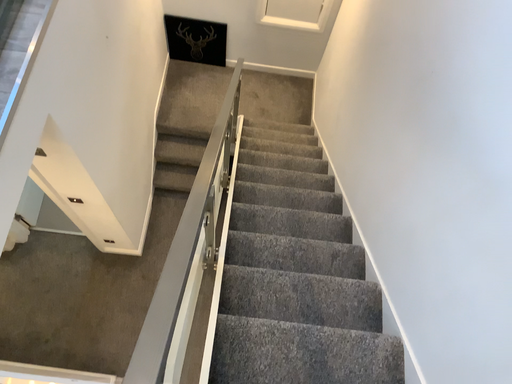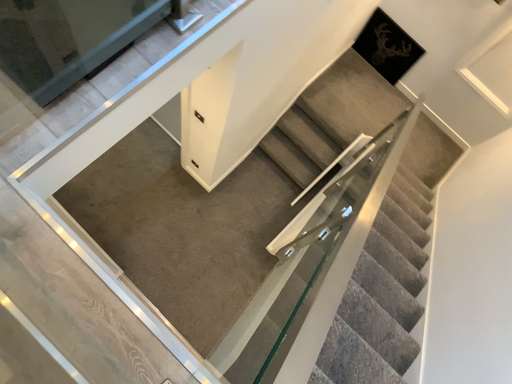
Question: Which way did the camera rotate in the video?

Choices:
 (A) rotated left
 (B) rotated right

Answer: (A)